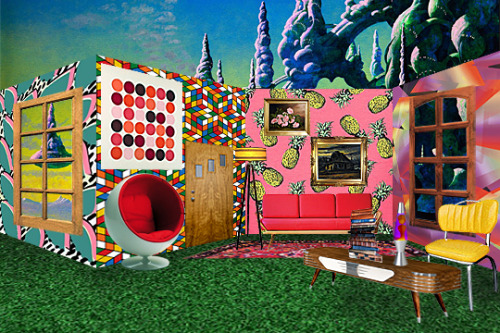
Identify the location of chair. (154, 229), (461, 256).